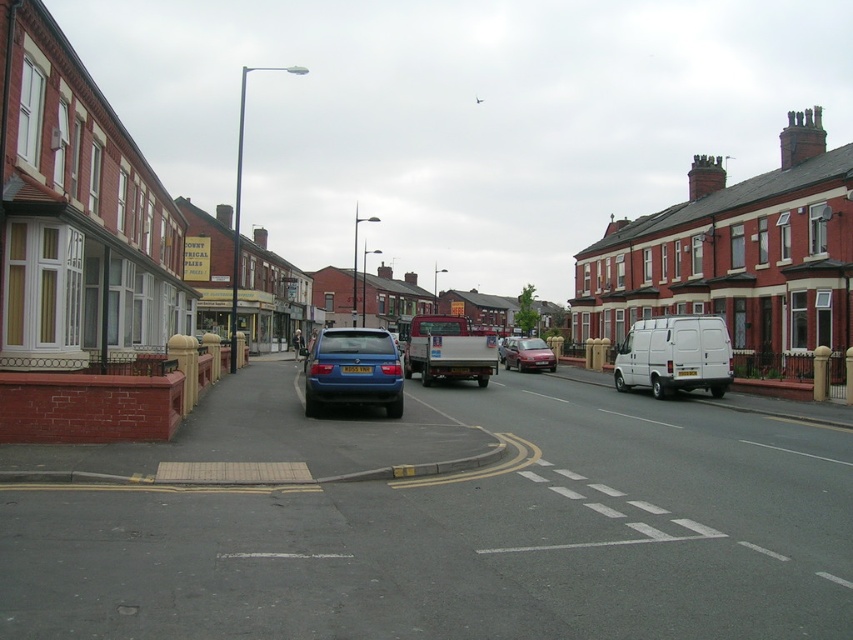
Does white matte van at center-right appear on the right side of matte white truck at center?

Yes, white matte van at center-right is to the right of matte white truck at center.

Is point (643, 381) positioned in front of point (428, 349)?

Yes, point (643, 381) is closer to viewer.

At what (x,y) coordinates should I click in order to perform the action: click on white matte van at center-right. Please return your answer as a coordinate pair (x, y). The height and width of the screenshot is (640, 853). Looking at the image, I should click on (675, 355).

Is metallic red sedan at center positioned before yellow matte license plate at center?

No, metallic red sedan at center is behind yellow matte license plate at center.

Is point (535, 346) behind point (347, 365)?

Yes.

Between point (538, 353) and point (354, 364), which one is positioned behind?

Positioned behind is point (538, 353).

Where is `metallic red sedan at center`? Image resolution: width=853 pixels, height=640 pixels. metallic red sedan at center is located at coordinates (527, 355).

Is white matte van at center-right positioned in front of metallic red sedan at center?

Yes, white matte van at center-right is closer to the viewer.

Can you confirm if white matte van at center-right is wider than metallic red sedan at center?

In fact, white matte van at center-right might be narrower than metallic red sedan at center.

Between point (682, 316) and point (537, 355), which one is positioned behind?

The point (537, 355) is more distant.

I want to click on white matte van at center-right, so click(675, 355).